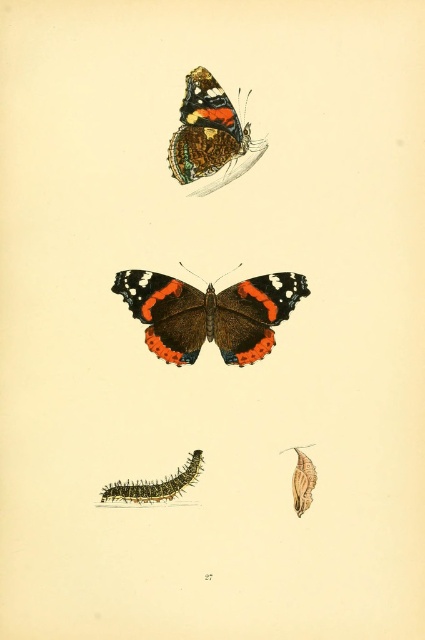
Between matte orange butterfly at upper center and fuzzy brown caterpillar at lower left, which one has more height?

With more height is matte orange butterfly at upper center.

Measure the distance from matte orange butterfly at upper center to fuzzy brown caterpillar at lower left.

The distance of matte orange butterfly at upper center from fuzzy brown caterpillar at lower left is 58.00 centimeters.

Who is more forward, (x=200, y=108) or (x=104, y=488)?

Point (x=104, y=488) is more forward.

Image resolution: width=425 pixels, height=640 pixels. Identify the location of matte orange butterfly at upper center. (209, 134).

Can you confirm if fuzzy brown caterpillar at lower left is thinner than matte brown chrysalis at center?

In fact, fuzzy brown caterpillar at lower left might be wider than matte brown chrysalis at center.

Is fuzzy brown caterpillar at lower left to the right of matte brown chrysalis at center from the viewer's perspective?

In fact, fuzzy brown caterpillar at lower left is to the left of matte brown chrysalis at center.

I want to click on fuzzy brown caterpillar at lower left, so click(155, 484).

Locate an element on the screen. The height and width of the screenshot is (640, 425). fuzzy brown caterpillar at lower left is located at coordinates (155, 484).

Who is taller, shiny brown butterfly at center or matte brown chrysalis at center?

With more height is shiny brown butterfly at center.

Does shiny brown butterfly at center have a smaller size compared to matte brown chrysalis at center?

Actually, shiny brown butterfly at center might be larger than matte brown chrysalis at center.

Is point (156, 291) positioned in front of point (309, 500)?

That is False.

Locate an element on the screen. Image resolution: width=425 pixels, height=640 pixels. shiny brown butterfly at center is located at coordinates [209, 314].